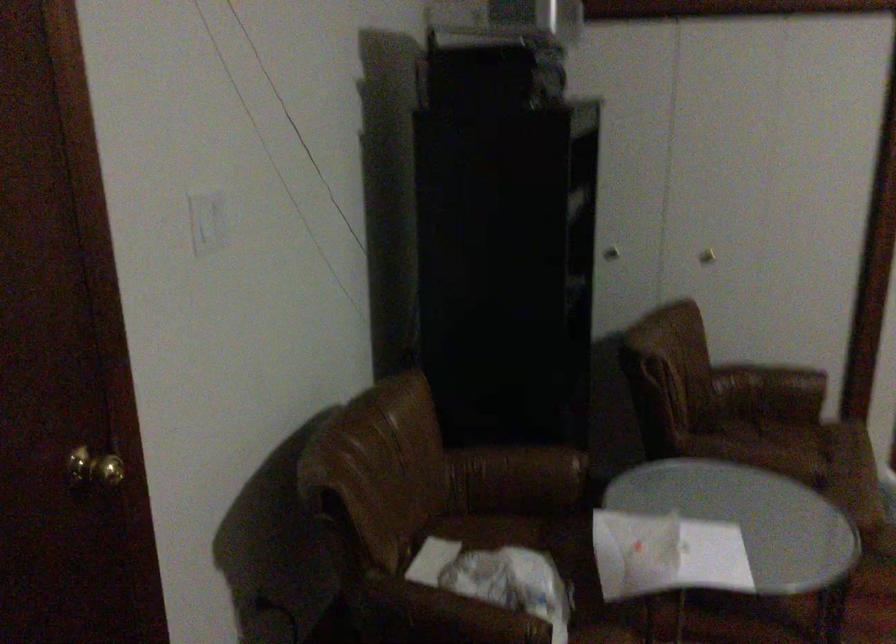
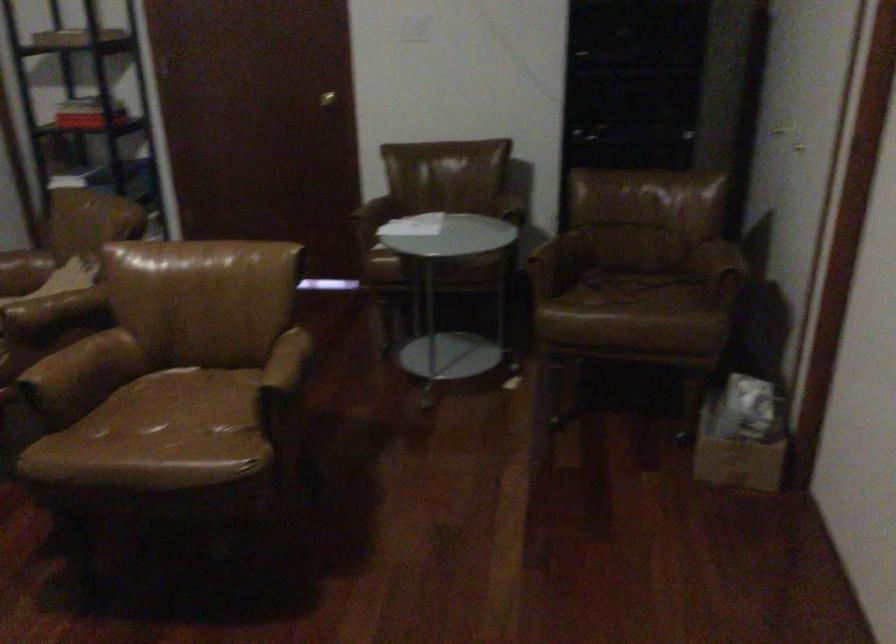
Locate, in the second image, the point that corresponds to (x=151, y=473) in the first image.

(326, 99)